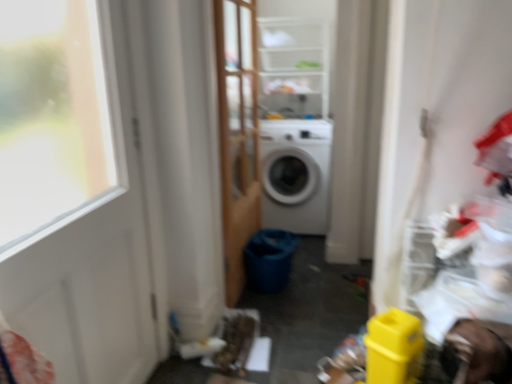
Describe the element at coordinates (293, 68) in the screenshot. I see `clear plastic shelves at upper center` at that location.

What are the coordinates of `white matte door at left` in the screenshot? It's located at (78, 194).

The width and height of the screenshot is (512, 384). I want to click on wooden screen door at center, so click(238, 133).

Image resolution: width=512 pixels, height=384 pixels. I want to click on clear plastic shelves at upper center, so click(x=293, y=68).

From a real-world perspective, is white matte washing machine at center physically located above or below wooden screen door at center?

From a real-world perspective, white matte washing machine at center is physically below wooden screen door at center.

From the image's perspective, does white matte washing machine at center appear lower than wooden screen door at center?

Yes, from the image's perspective, white matte washing machine at center is beneath wooden screen door at center.

Between point (287, 220) and point (236, 94), which one is positioned behind?

The point (287, 220) is farther from the camera.

How many degrees apart are the facing directions of white matte washing machine at center and wooden screen door at center?

89 degrees.

Is wooden screen door at center completely or partially outside of white matte door at left?

Indeed, wooden screen door at center is completely outside white matte door at left.

Is wooden screen door at center to the left of white matte door at left from the viewer's perspective?

No.

Are wooden screen door at center and white matte door at left located far from each other?

wooden screen door at center is near white matte door at left, not far away.

From a real-world perspective, relative to white matte door at left, is wooden screen door at center vertically above or below?

wooden screen door at center is above white matte door at left.

Is the depth of white matte door at left greater than that of white matte washing machine at center?

No, it is not.

Are white matte door at left and white matte washing machine at center far apart?

Yes, white matte door at left and white matte washing machine at center are located far from each other.

Between white matte door at left and white matte washing machine at center, which one appears on the right side from the viewer's perspective?

white matte washing machine at center.

Between white matte door at left and white matte washing machine at center, which one has smaller size?

Smaller between the two is white matte door at left.

The image size is (512, 384). Identify the location of shelf located in front of the white matte washing machine at center. (293, 68).

Is clear plastic shelves at upper center not inside white matte washing machine at center?

That's correct, clear plastic shelves at upper center is outside of white matte washing machine at center.

Consider the image. From the image's perspective, is clear plastic shelves at upper center located above or below white matte washing machine at center?

clear plastic shelves at upper center is above white matte washing machine at center.

From a real-world perspective, does clear plastic shelves at upper center stand above white matte washing machine at center?

Yes, from a real-world perspective, clear plastic shelves at upper center is on top of white matte washing machine at center.

Does wooden screen door at center have a greater width compared to white matte washing machine at center?

In fact, wooden screen door at center might be narrower than white matte washing machine at center.

Is wooden screen door at center further to the viewer compared to white matte washing machine at center?

No, wooden screen door at center is closer to the viewer.

Considering the relative sizes of wooden screen door at center and white matte washing machine at center in the image provided, is wooden screen door at center smaller than white matte washing machine at center?

Indeed, wooden screen door at center has a smaller size compared to white matte washing machine at center.

Would you say wooden screen door at center is inside or outside white matte washing machine at center?

wooden screen door at center is spatially situated outside white matte washing machine at center.

In terms of width, does white matte washing machine at center look wider or thinner when compared to white matte door at left?

In the image, white matte washing machine at center appears to be wider than white matte door at left.

Can you confirm if white matte washing machine at center is smaller than white matte door at left?

No, white matte washing machine at center is not smaller than white matte door at left.

Where is `washing machine that appears behind the white matte door at left`? washing machine that appears behind the white matte door at left is located at coordinates (295, 174).

Is white matte washing machine at center further to the viewer compared to white matte door at left?

Yes, the depth of white matte washing machine at center is greater than that of white matte door at left.

From the image's perspective, which object appears higher, clear plastic shelves at upper center or wooden screen door at center?

clear plastic shelves at upper center is shown above in the image.

Which object is wider, clear plastic shelves at upper center or wooden screen door at center?

With larger width is clear plastic shelves at upper center.

How much distance is there between clear plastic shelves at upper center and wooden screen door at center?

They are 21.14 inches apart.

Is clear plastic shelves at upper center bigger than wooden screen door at center?

Yes.

I want to click on washing machine that appears below the wooden screen door at center (from the image's perspective), so tap(295, 174).

Locate an element on the screen. The image size is (512, 384). screen door above the white matte door at left (from a real-world perspective) is located at coordinates (238, 133).

Estimate the real-world distances between objects in this image. Which object is further from white matte door at left, wooden screen door at center or white matte washing machine at center?

white matte washing machine at center.

Which object lies nearer to the anchor point white matte washing machine at center, white matte door at left or clear plastic shelves at upper center?

Based on the image, clear plastic shelves at upper center appears to be nearer to white matte washing machine at center.

Based on their spatial positions, is clear plastic shelves at upper center or wooden screen door at center further from white matte door at left?

clear plastic shelves at upper center.

Which object lies further to the anchor point wooden screen door at center, white matte washing machine at center or white matte door at left?

Based on the image, white matte door at left appears to be further to wooden screen door at center.

Based on their spatial positions, is wooden screen door at center or clear plastic shelves at upper center closer to white matte door at left?

Among the two, wooden screen door at center is located nearer to white matte door at left.

Looking at the image, which one is located closer to clear plastic shelves at upper center, wooden screen door at center or white matte washing machine at center?

Based on the image, wooden screen door at center appears to be nearer to clear plastic shelves at upper center.

Estimate the real-world distances between objects in this image. Which object is further from white matte washing machine at center, wooden screen door at center or white matte door at left?

Among the two, white matte door at left is located further to white matte washing machine at center.

From the image, which object appears to be nearer to wooden screen door at center, clear plastic shelves at upper center or white matte door at left?

The object closer to wooden screen door at center is clear plastic shelves at upper center.

Locate an element on the screen. The width and height of the screenshot is (512, 384). screen door between white matte door at left and clear plastic shelves at upper center in the front-back direction is located at coordinates (238, 133).

Locate an element on the screen. Image resolution: width=512 pixels, height=384 pixels. shelf located between wooden screen door at center and white matte washing machine at center in the depth direction is located at coordinates (293, 68).

Where is `shelf positioned between white matte door at left and white matte washing machine at center from near to far`? This screenshot has width=512, height=384. shelf positioned between white matte door at left and white matte washing machine at center from near to far is located at coordinates (293, 68).

Where is `screen door between white matte door at left and white matte washing machine at center along the z-axis`? screen door between white matte door at left and white matte washing machine at center along the z-axis is located at coordinates click(238, 133).